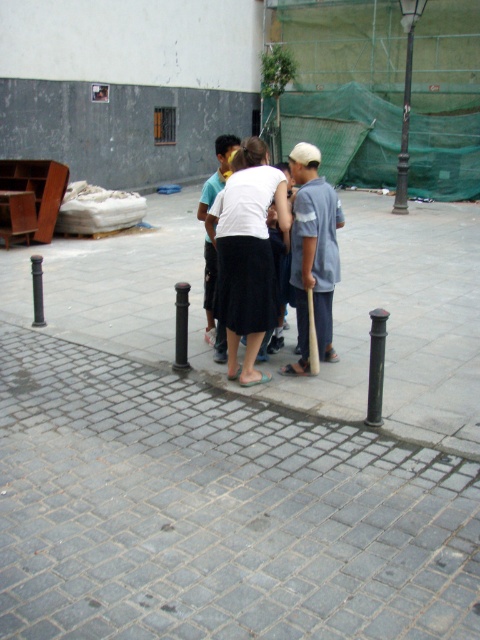
Does gray cobblestone pavement at center have a greater width compared to light blue cotton shirt at center?

Indeed, gray cobblestone pavement at center has a greater width compared to light blue cotton shirt at center.

Who is more distant from viewer, (33,349) or (325,291)?

The point (33,349) is more distant.

Who is more forward, (309,477) or (323,300)?

Point (309,477) is in front.

At what (x,y) coordinates should I click in order to perform the action: click on gray cobblestone pavement at center. Please return your answer as a coordinate pair (x, y). Looking at the image, I should click on (216, 512).

Between point (264, 426) and point (252, 205), which one is positioned in front?

Point (264, 426) is more forward.

Between gray cobblestone pavement at center and white matte skirt at center, which one appears on the right side from the viewer's perspective?

From the viewer's perspective, white matte skirt at center appears more on the right side.

Who is more distant from viewer, (288, 584) or (231, 371)?

Point (231, 371)

What are the coordinates of `gray cobblestone pavement at center` in the screenshot? It's located at (216, 512).

Who is positioned more to the left, black metal pole at center or bronze textured pole at upper right?

black metal pole at center

Is black metal pole at center closer to camera compared to bronze textured pole at upper right?

Yes, black metal pole at center is in front of bronze textured pole at upper right.

Does point (375, 416) come behind point (412, 28)?

No, (375, 416) is in front of (412, 28).

Locate an element on the screen. This screenshot has width=480, height=640. black metal pole at center is located at coordinates (375, 365).